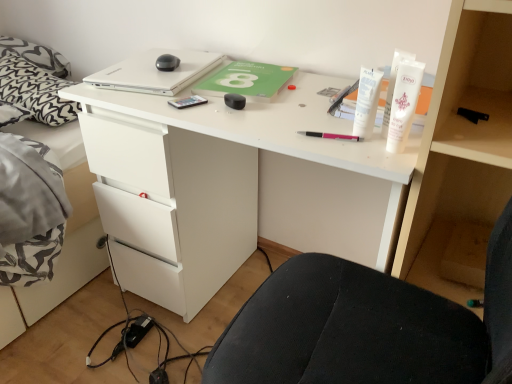
Question: Considering the relative positions of black plastic pen at upper right, placed as the fourth stationery when sorted from back to front, and white matte tube at upper right, which is the first toiletry from right to left, in the image provided, is black plastic pen at upper right, placed as the fourth stationery when sorted from back to front, to the left or to the right of white matte tube at upper right, which is the first toiletry from right to left,?

Choices:
 (A) left
 (B) right

Answer: (B)

Question: Would you say black plastic pen at upper right, the 1th stationery viewed from the front, is inside or outside white matte tube at upper right, which is the first toiletry from right to left?

Choices:
 (A) outside
 (B) inside

Answer: (A)

Question: Estimate the real-world distances between objects in this image. Which object is farther from the pink plastic pen at center, acting as the 3th stationery starting from the back?

Choices:
 (A) black rubberized mouse at center, arranged as the 3th stationery when viewed from the right
 (B) white matte tube at upper right, the second toiletry viewed from the right
 (C) white matte tube at upper right, which is the first toiletry from right to left
 (D) satin silver phone at center, positioned as the 1th stationery in left-to-right order
 (E) gray fabric bed at left

Answer: (E)

Question: Estimate the real-world distances between objects in this image. Which object is farther from the matte white bookshelf at right?

Choices:
 (A) black rubberized mouse at center, which is counted as the second stationery, starting from the back
 (B) satin silver phone at center, which is the 4th stationery in front-to-back order
 (C) black plastic pen at upper right, the 1th stationery viewed from the front
 (D) white matte tube at upper right, the 1th toiletry in the left-to-right sequence
 (E) white matte tube at upper right, which is the first toiletry from right to left

Answer: (B)